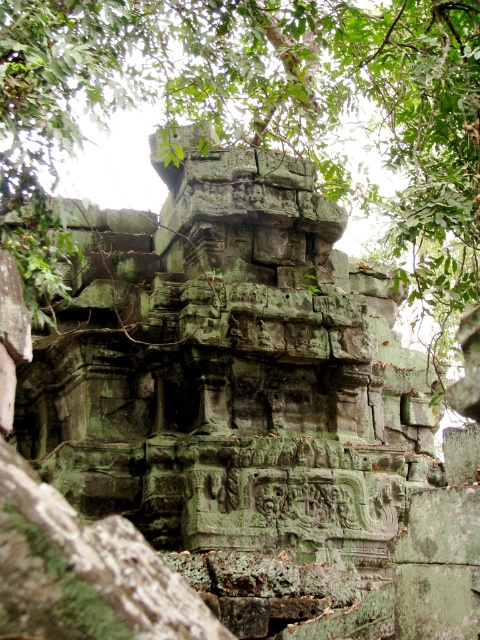
You are an archaeologist examining the ancient stone structure. You notice a specific point marked at coordinates [273,96]. What is the object located at this point?

The green mossy stone at upper center is located at point [273,96].